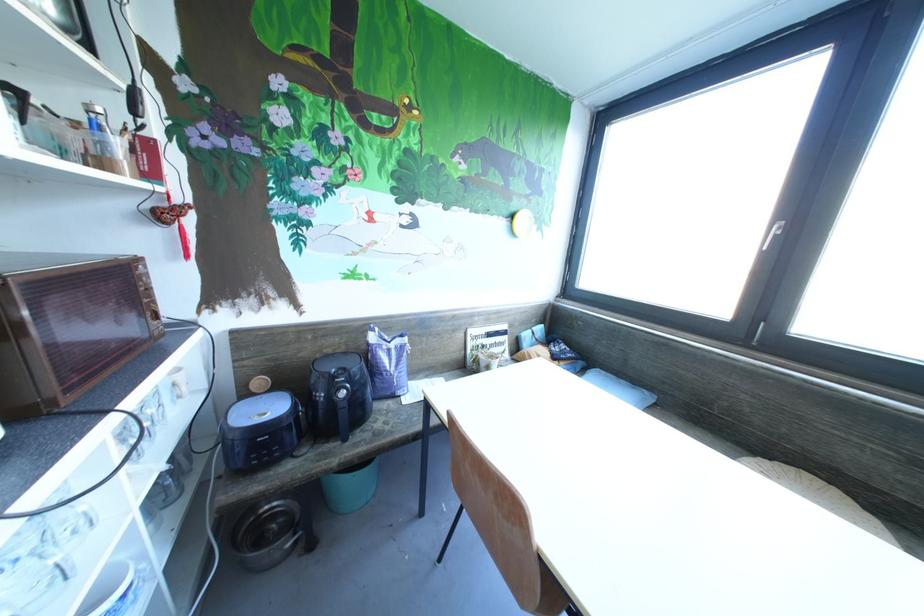
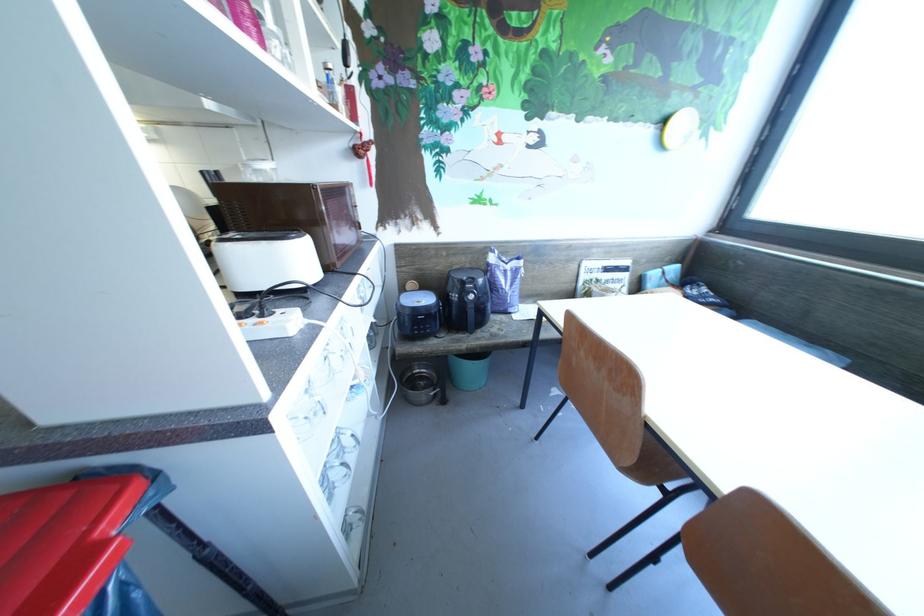
The point at (348, 416) is marked in the first image. Where is the corresponding point in the second image?

(477, 315)